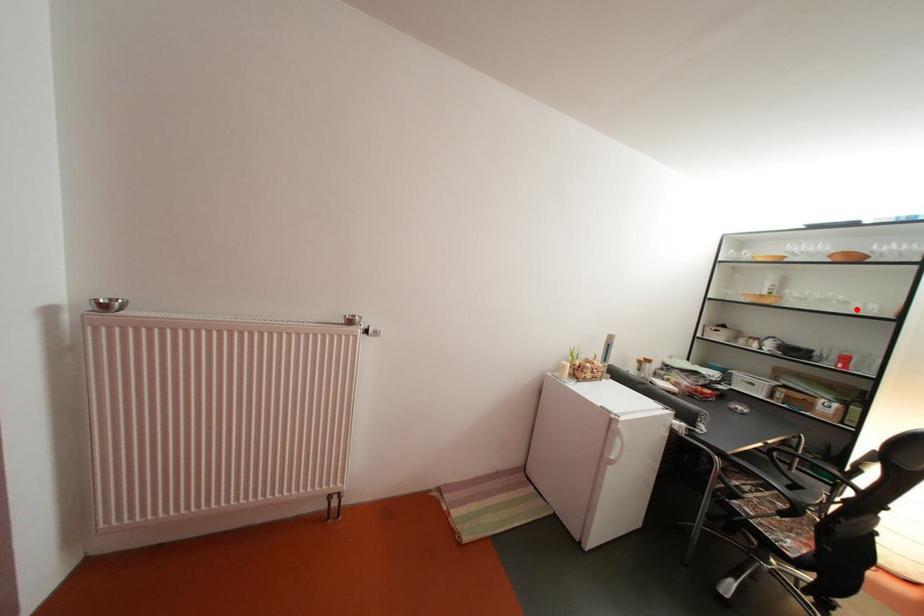
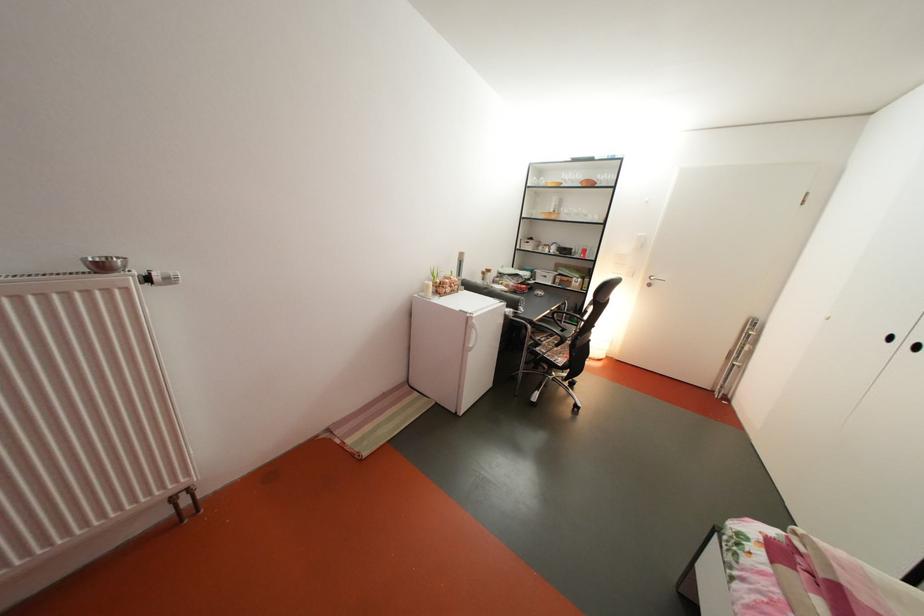
Question: I am providing you with two images of the same scene from different viewpoints. In image1, a red point is highlighted. Considering the same 3D point in image2, which of the following is correct?

Choices:
 (A) It is closer
 (B) It is farther

Answer: (A)